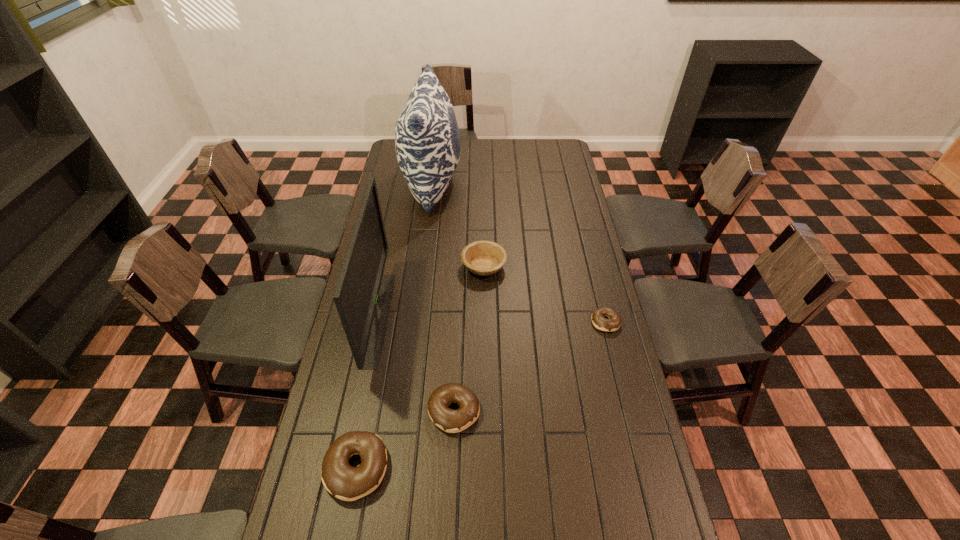
This screenshot has width=960, height=540. In order to click on doughnut that is the closest to the bowl in this screenshot , I will do `click(599, 321)`.

I want to click on free location that satisfies the following two spatial constraints: 1. on the front surface of the bowl; 2. on the left side of the cushion, so click(421, 266).

Where is `blank area in the image that satisfies the following two spatial constraints: 1. on the front-facing side of the second tallest object; 2. on the left side of the shortest object`? The image size is (960, 540). blank area in the image that satisfies the following two spatial constraints: 1. on the front-facing side of the second tallest object; 2. on the left side of the shortest object is located at coordinates (378, 322).

This screenshot has height=540, width=960. Find the location of `free spot that satisfies the following two spatial constraints: 1. on the back side of the second farthest doughnut; 2. on the right side of the rightmost doughnut`. free spot that satisfies the following two spatial constraints: 1. on the back side of the second farthest doughnut; 2. on the right side of the rightmost doughnut is located at coordinates (458, 322).

Locate an element on the screen. free space that satisfies the following two spatial constraints: 1. on the front surface of the farthest object; 2. on the left side of the bowl is located at coordinates (421, 266).

The image size is (960, 540). In order to click on blank area in the image that satisfies the following two spatial constraints: 1. on the front-facing side of the shortest object; 2. on the left side of the second tallest object in this screenshot , I will do `click(378, 322)`.

Locate an element on the screen. The width and height of the screenshot is (960, 540). free space that satisfies the following two spatial constraints: 1. on the front surface of the bowl; 2. on the right side of the farthest object is located at coordinates (421, 266).

At what (x,y) coordinates should I click in order to perform the action: click on free space that satisfies the following two spatial constraints: 1. on the back side of the rightmost object; 2. on the front-facing side of the second tallest object. Please return your answer as a coordinate pair (x, y). Looking at the image, I should click on (605, 318).

Where is `free location that satisfies the following two spatial constraints: 1. on the front-facing side of the shortest doughnut; 2. on the left side of the second tallest object`? free location that satisfies the following two spatial constraints: 1. on the front-facing side of the shortest doughnut; 2. on the left side of the second tallest object is located at coordinates (378, 322).